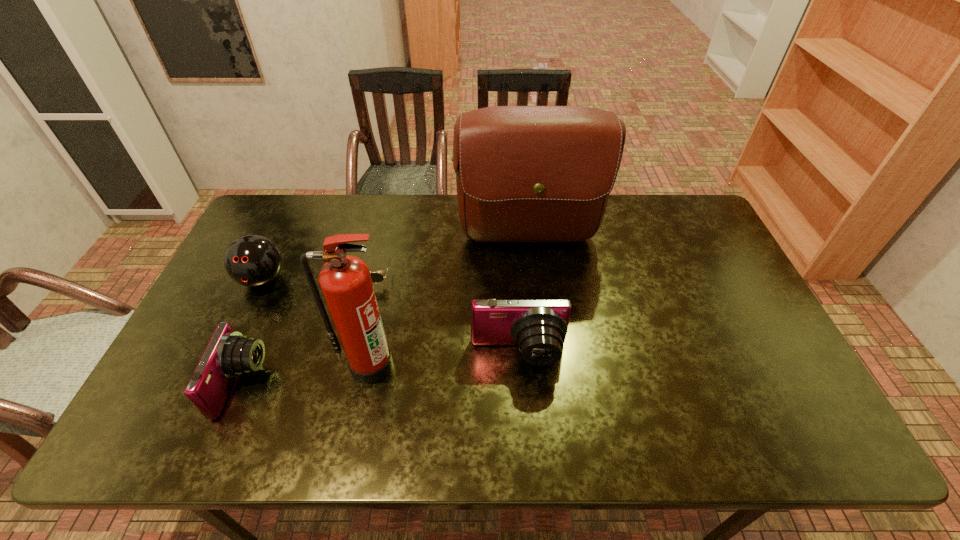
Considering the uniform spacing of cameras, where should an additional camera be positioned on the right? Please locate a free spot. Please provide its 2D coordinates. Your answer should be formatted as a tuple, i.e. [(x, y)], where the tuple contains the x and y coordinates of a point satisfying the conditions above.

[(767, 328)]